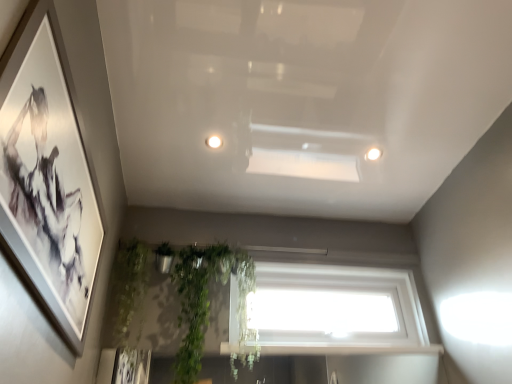
Question: From the image's perspective, would you say white glossy light fixture at upper right, the 1th lighting from the right, is positioned over matte black picture frame at left?

Choices:
 (A) yes
 (B) no

Answer: (A)

Question: Considering the relative sizes of white glossy light fixture at upper right, positioned as the first lighting in back-to-front order, and matte black picture frame at left in the image provided, is white glossy light fixture at upper right, positioned as the first lighting in back-to-front order, taller than matte black picture frame at left?

Choices:
 (A) yes
 (B) no

Answer: (B)

Question: Does white glossy light fixture at upper right, positioned as the first lighting in back-to-front order, have a greater width compared to matte black picture frame at left?

Choices:
 (A) no
 (B) yes

Answer: (B)

Question: From a real-world perspective, is white glossy light fixture at upper right, the first lighting from the bottom, on matte black picture frame at left?

Choices:
 (A) no
 (B) yes

Answer: (B)

Question: From a real-world perspective, is white glossy light fixture at center, positioned as the second lighting in back-to-front order, above or below white glossy window sill at lower center?

Choices:
 (A) above
 (B) below

Answer: (A)

Question: From the image's perspective, relative to white glossy window sill at lower center, is white glossy light fixture at center, positioned as the second lighting in back-to-front order, above or below?

Choices:
 (A) above
 (B) below

Answer: (A)

Question: Considering the positions of white glossy light fixture at center, positioned as the second lighting in back-to-front order, and white glossy window sill at lower center in the image, is white glossy light fixture at center, positioned as the second lighting in back-to-front order, wider or thinner than white glossy window sill at lower center?

Choices:
 (A) wide
 (B) thin

Answer: (B)

Question: Which is correct: white glossy light fixture at center, which ranks as the 2th lighting in bottom-to-top order, is inside white glossy window sill at lower center, or outside of it?

Choices:
 (A) inside
 (B) outside

Answer: (B)

Question: In terms of width, does white glossy light fixture at center, which is the 1th lighting from left to right, look wider or thinner when compared to white glossy light fixture at upper right, which appears as the second lighting when viewed from the front?

Choices:
 (A) wide
 (B) thin

Answer: (A)

Question: Based on their positions, is white glossy light fixture at center, which ranks as the 2th lighting in bottom-to-top order, located to the left or right of white glossy light fixture at upper right, the 1th lighting from the right?

Choices:
 (A) right
 (B) left

Answer: (B)

Question: In terms of size, does white glossy light fixture at center, the first lighting in the front-to-back sequence, appear bigger or smaller than white glossy light fixture at upper right, the 1th lighting from the right?

Choices:
 (A) small
 (B) big

Answer: (A)

Question: Is point (208, 140) closer or farther from the camera than point (377, 150)?

Choices:
 (A) closer
 (B) farther

Answer: (A)

Question: Is white glossy light fixture at center, the first lighting in the front-to-back sequence, inside or outside of transparent glass window at center?

Choices:
 (A) inside
 (B) outside

Answer: (B)

Question: Visually, is white glossy light fixture at center, the first lighting in the front-to-back sequence, positioned to the left or to the right of transparent glass window at center?

Choices:
 (A) right
 (B) left

Answer: (B)